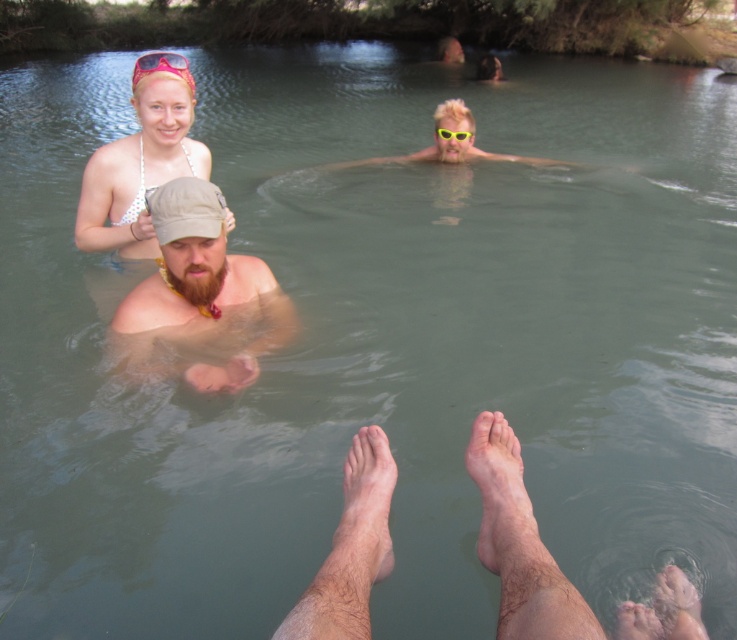
You are a photographer trying to capture a closeup shot of the pink plastic goggles at upper center and the yellow plastic goggles at upper center. Which goggles are located to the left of the other?

The pink plastic goggles at upper center are positioned on the left side of yellow plastic goggles at upper center.

You are a photographer trying to capture a group shot of the swimmers. You want to ensure that both the white bikini top at upper left and the barefoot feet at lower center are clearly visible in the frame. Based on their positions, which object is wider and might require more space in the photo composition?

The white bikini top at upper left might be wider than the barefoot feet at lower center, so it would require more space in the photo composition.